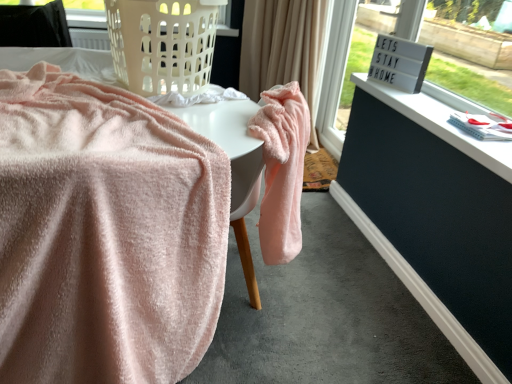
Question: Are velvet pink table at center, the second table viewed from the left, and black fabric at upper left located far from each other?

Choices:
 (A) yes
 (B) no

Answer: (A)

Question: From a real-world perspective, does velvet pink table at center, the second table viewed from the left, stand above black fabric at upper left?

Choices:
 (A) no
 (B) yes

Answer: (A)

Question: Considering the relative sizes of velvet pink table at center, which is the 1th table from right to left, and black fabric at upper left in the image provided, is velvet pink table at center, which is the 1th table from right to left, thinner than black fabric at upper left?

Choices:
 (A) yes
 (B) no

Answer: (B)

Question: Is velvet pink table at center, the second table viewed from the left, bigger than black fabric at upper left?

Choices:
 (A) yes
 (B) no

Answer: (A)

Question: Considering the relative sizes of velvet pink table at center, the second table viewed from the left, and black fabric at upper left in the image provided, is velvet pink table at center, the second table viewed from the left, wider than black fabric at upper left?

Choices:
 (A) no
 (B) yes

Answer: (B)

Question: Does velvet pink table at center, which is the 1th table from right to left, have a smaller size compared to black fabric at upper left?

Choices:
 (A) yes
 (B) no

Answer: (B)

Question: Does dark blue painted wood dresser at lower right come in front of velvet pink table at center, which is the 1th table from right to left?

Choices:
 (A) no
 (B) yes

Answer: (A)

Question: From a real-world perspective, does dark blue painted wood dresser at lower right stand above velvet pink table at center, the second table viewed from the left?

Choices:
 (A) no
 (B) yes

Answer: (A)

Question: Is dark blue painted wood dresser at lower right not inside velvet pink table at center, which is the 1th table from right to left?

Choices:
 (A) no
 (B) yes

Answer: (B)

Question: Considering the relative sizes of dark blue painted wood dresser at lower right and velvet pink table at center, which is the 1th table from right to left, in the image provided, is dark blue painted wood dresser at lower right smaller than velvet pink table at center, which is the 1th table from right to left,?

Choices:
 (A) yes
 (B) no

Answer: (A)

Question: Is dark blue painted wood dresser at lower right positioned behind velvet pink table at center, which is the 1th table from right to left?

Choices:
 (A) no
 (B) yes

Answer: (B)

Question: Is dark blue painted wood dresser at lower right shorter than velvet pink table at center, the second table viewed from the left?

Choices:
 (A) no
 (B) yes

Answer: (B)

Question: From a real-world perspective, does velvet pink table at center, the second table viewed from the left, sit lower than soft pink towel at center, arranged as the 1th table when viewed from the left?

Choices:
 (A) yes
 (B) no

Answer: (B)